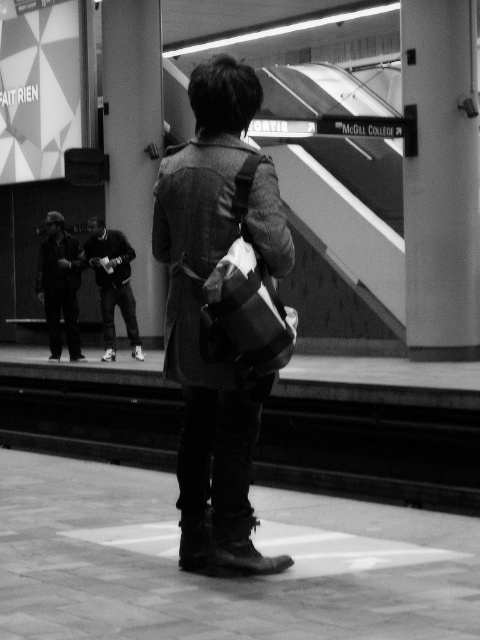
You are standing at the subway station platform. There are two points marked on the platform, one at coordinates point (421, 180) and another at point (60, 355). Which point is closer to you?

Point (421, 180) is closer to the viewer than point (60, 355).

You are a photographer trying to capture a wide shot of the subway platform. You notice the smooth concrete pillar at upper left and the dark fabric jacket at lower left. Which object is narrower in width?

The smooth concrete pillar at upper left is narrower in width compared to the dark fabric jacket at lower left.

In the scene shown: You are standing at point (78, 250) and want to walk to point (127, 65). Is the destination point behind you or in front of you?

The destination point (127, 65) is behind you because it is located behind point (78, 250) where you are standing.